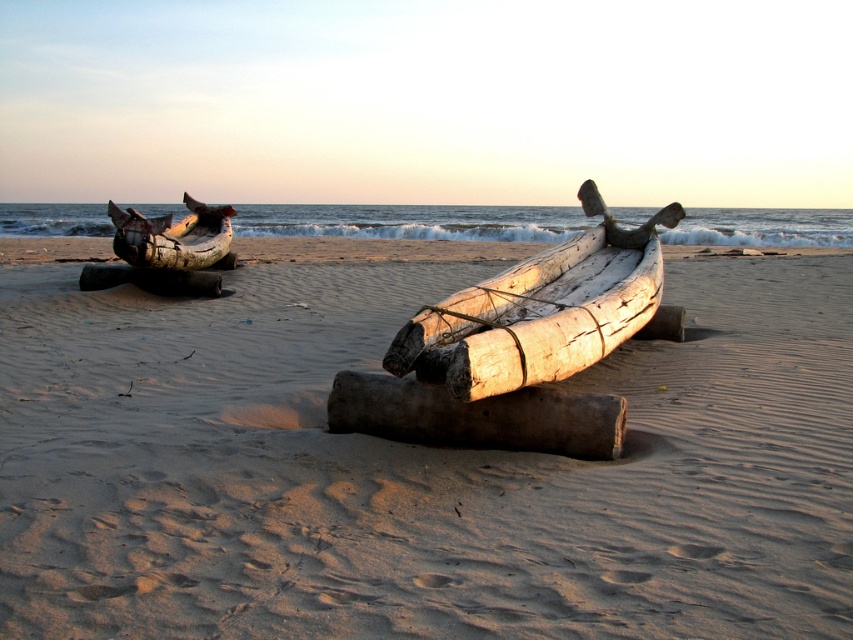
Between point (502, 289) and point (578, 426), which one is positioned in front?

Positioned in front is point (578, 426).

Is light brown wooden boat at center to the left of dark brown wood log at center from the viewer's perspective?

No, light brown wooden boat at center is not to the left of dark brown wood log at center.

Does point (495, 353) lie behind point (585, 445)?

That is False.

This screenshot has height=640, width=853. Identify the location of light brown wooden boat at center. (540, 310).

Is point (675, 497) farther from camera compared to point (451, 340)?

That is False.

Between point (59, 422) and point (540, 289), which one is positioned behind?

Positioned behind is point (540, 289).

The width and height of the screenshot is (853, 640). Find the location of `smooth sand at center`. smooth sand at center is located at coordinates (416, 467).

Is smooth sand at center thinner than dark brown wood log at center?

No, smooth sand at center is not thinner than dark brown wood log at center.

Which of these two, smooth sand at center or dark brown wood log at center, stands taller?

With more height is smooth sand at center.

Which is in front, point (206, 595) or point (616, 452)?

Point (206, 595)

The width and height of the screenshot is (853, 640). In order to click on smooth sand at center in this screenshot , I will do `click(416, 467)`.